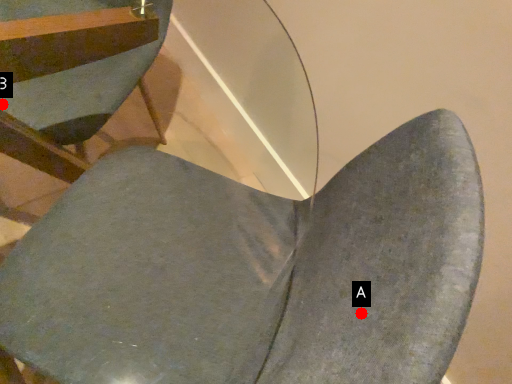
Question: Two points are circled on the image, labeled by A and B beside each circle. Which point is closer to the camera?

Choices:
 (A) A is closer
 (B) B is closer

Answer: (A)